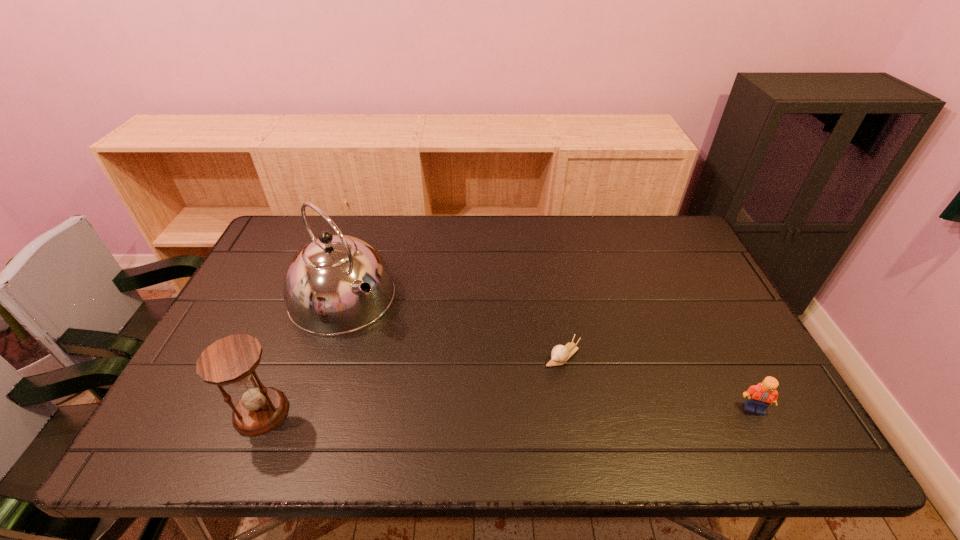
Where is `vacant space located from the spout of the farthest object`? vacant space located from the spout of the farthest object is located at coordinates (432, 381).

Find the location of `vacant space located 0.130m on the shell of the third object from left to right`. vacant space located 0.130m on the shell of the third object from left to right is located at coordinates (518, 398).

Find the location of a particular element. vacant space situated 0.110m on the shell of the third object from left to right is located at coordinates (524, 393).

I want to click on hourglass that is at the near edge, so click(x=232, y=360).

Where is `Lego located at the near edge`? Image resolution: width=960 pixels, height=540 pixels. Lego located at the near edge is located at coordinates (760, 396).

The width and height of the screenshot is (960, 540). What are the coordinates of `hourglass that is at the left edge` in the screenshot? It's located at (232, 360).

In order to click on kettle positioned at the left edge in this screenshot , I will do `click(337, 284)`.

Locate an element on the screen. This screenshot has width=960, height=540. object that is at the right edge is located at coordinates (760, 396).

Locate an element on the screen. object that is at the near left corner is located at coordinates (232, 360).

The width and height of the screenshot is (960, 540). I want to click on object located at the near right corner, so coord(760,396).